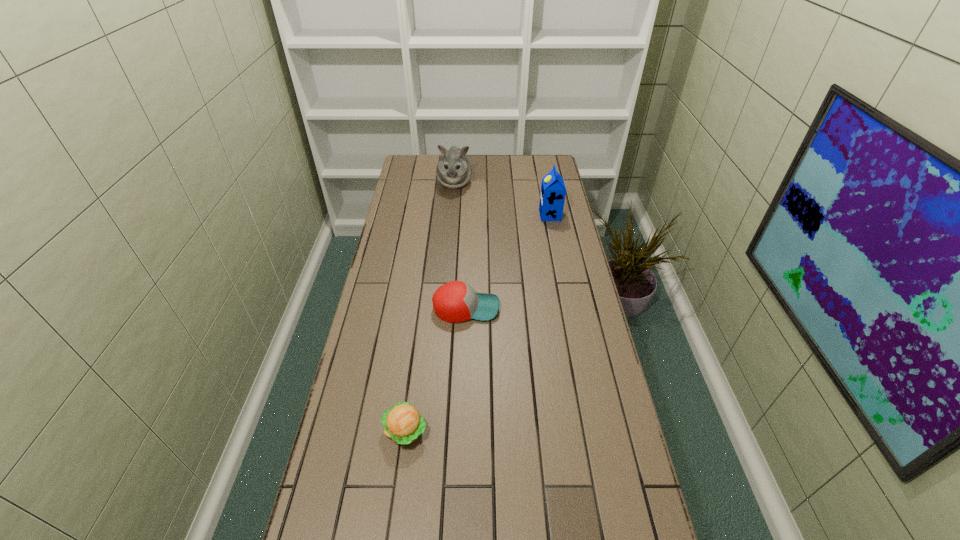
This screenshot has width=960, height=540. I want to click on carton, so click(552, 197).

In order to click on the third nearest object in this screenshot , I will do `click(552, 197)`.

Find the location of `hamster`. hamster is located at coordinates (453, 170).

I want to click on baseball cap, so [456, 301].

Locate an element on the screen. This screenshot has height=540, width=960. hamburger is located at coordinates (402, 423).

Locate an element on the screen. vacant space located with the cap open on the carton is located at coordinates (490, 215).

The width and height of the screenshot is (960, 540). What are the coordinates of `vacant space located 0.090m with the cap open on the carton` in the screenshot? It's located at (518, 215).

The image size is (960, 540). In order to click on vacant space located with the cap open on the carton in this screenshot , I will do `click(445, 215)`.

Locate an element on the screen. The image size is (960, 540). vacant space located 0.360m on the face of the hamster is located at coordinates (449, 247).

This screenshot has height=540, width=960. I want to click on vacant region located 0.160m at the brim of the second nearest object, so click(547, 308).